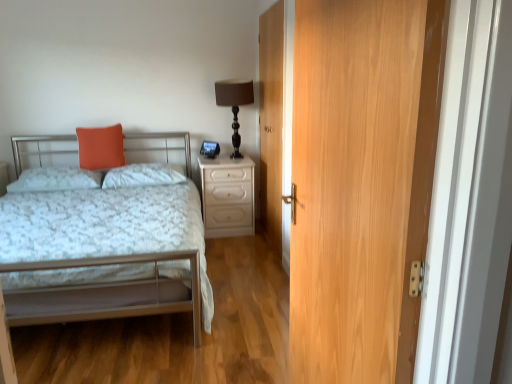
Question: Is wooden door at center, placed as the 2th door when sorted from front to back, to the left of metallic silver bed at left from the viewer's perspective?

Choices:
 (A) no
 (B) yes

Answer: (A)

Question: Considering the relative sizes of wooden door at center, which appears as the first door when viewed from the back, and metallic silver bed at left in the image provided, is wooden door at center, which appears as the first door when viewed from the back, taller than metallic silver bed at left?

Choices:
 (A) no
 (B) yes

Answer: (B)

Question: Is wooden door at center, placed as the 2th door when sorted from front to back, beside metallic silver bed at left?

Choices:
 (A) no
 (B) yes

Answer: (A)

Question: Is metallic silver bed at left surrounded by wooden door at center, placed as the 2th door when sorted from front to back?

Choices:
 (A) yes
 (B) no

Answer: (B)

Question: Is wooden door at center, which appears as the first door when viewed from the back, closer to camera compared to metallic silver bed at left?

Choices:
 (A) yes
 (B) no

Answer: (B)

Question: In the image, is light brown wood door at right, which is counted as the 2th door, starting from the back, positioned in front of or behind white fluffy pillow at center, the 2th pillow viewed from the left?

Choices:
 (A) front
 (B) behind

Answer: (A)

Question: From a real-world perspective, relative to white fluffy pillow at center, which is the first pillow in right-to-left order, is light brown wood door at right, which is counted as the 2th door, starting from the back, vertically above or below?

Choices:
 (A) below
 (B) above

Answer: (B)

Question: From the image's perspective, is light brown wood door at right, the 1th door from the front, above or below white fluffy pillow at center, the 2th pillow viewed from the left?

Choices:
 (A) above
 (B) below

Answer: (B)

Question: In terms of height, does light brown wood door at right, which is counted as the 2th door, starting from the back, look taller or shorter compared to white fluffy pillow at center, the 2th pillow viewed from the left?

Choices:
 (A) tall
 (B) short

Answer: (A)

Question: Considering the positions of white glossy nightstand at right and metallic silver bed at left in the image, is white glossy nightstand at right taller or shorter than metallic silver bed at left?

Choices:
 (A) short
 (B) tall

Answer: (A)

Question: Relative to metallic silver bed at left, is white glossy nightstand at right in front or behind?

Choices:
 (A) behind
 (B) front

Answer: (A)

Question: From the image's perspective, is white glossy nightstand at right positioned above or below metallic silver bed at left?

Choices:
 (A) above
 (B) below

Answer: (A)

Question: Visually, is white glossy nightstand at right positioned to the left or to the right of metallic silver bed at left?

Choices:
 (A) right
 (B) left

Answer: (A)

Question: Is metallic silver bed at left wider or thinner than white fluffy pillow at center, the 2th pillow viewed from the left?

Choices:
 (A) thin
 (B) wide

Answer: (B)

Question: Would you say metallic silver bed at left is to the left or to the right of white fluffy pillow at center, which is the first pillow in right-to-left order, in the picture?

Choices:
 (A) left
 (B) right

Answer: (A)